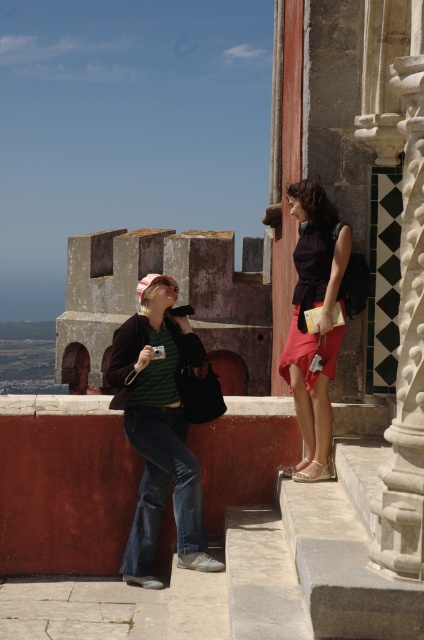
Looking at this image, does green striped shirt at center come in front of matte black top at center?

Yes, green striped shirt at center is in front of matte black top at center.

Who is more forward, (198, 467) or (303, 275)?

Point (198, 467) is in front.

Between point (161, 403) and point (295, 372), which one is positioned in front?

Point (161, 403)

Where is `green striped shirt at center`? The height and width of the screenshot is (640, 424). green striped shirt at center is located at coordinates (159, 428).